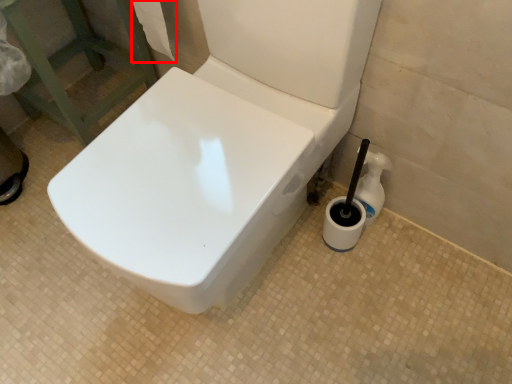
Question: From the image's perspective, where is toilet paper (annotated by the red box) located in relation to cleaning product in the image?

Choices:
 (A) below
 (B) above

Answer: (B)